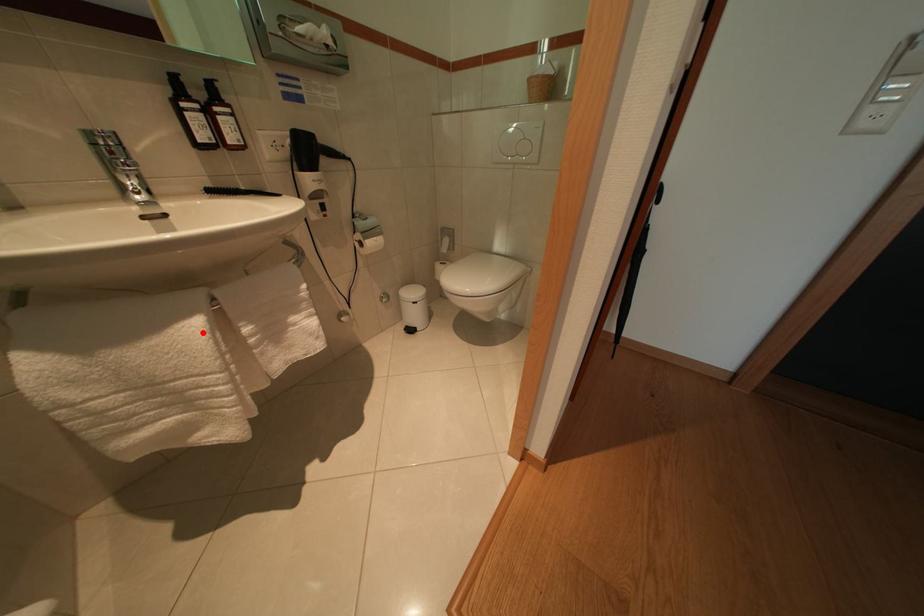
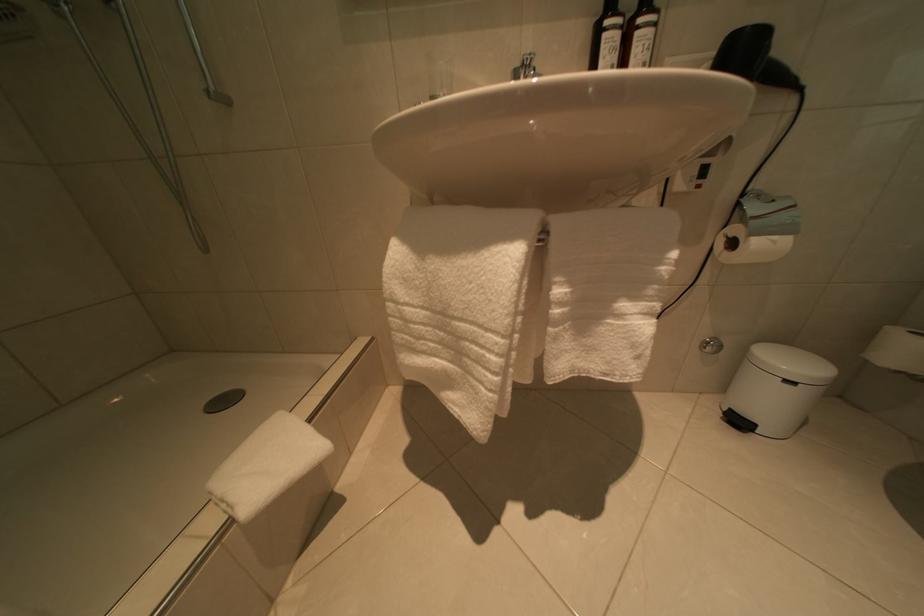
Where in the second image is the point corresponding to the highlighted location from the first image?

(517, 262)